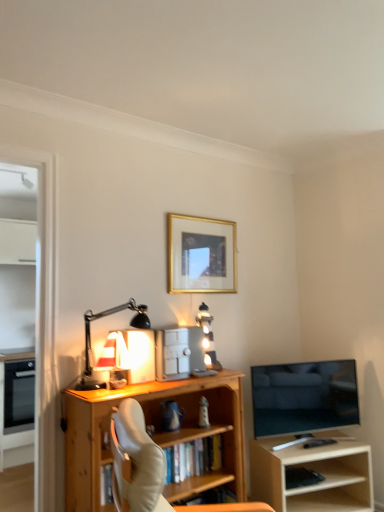
Question: Is black matte desk lamp at left not within light wood shelf at right?

Choices:
 (A) no
 (B) yes

Answer: (B)

Question: Would you say black matte desk lamp at left contains light wood shelf at right?

Choices:
 (A) no
 (B) yes

Answer: (A)

Question: Is black matte desk lamp at left positioned behind light wood shelf at right?

Choices:
 (A) yes
 (B) no

Answer: (B)

Question: Considering the relative sizes of black matte desk lamp at left and light wood shelf at right in the image provided, is black matte desk lamp at left bigger than light wood shelf at right?

Choices:
 (A) no
 (B) yes

Answer: (A)

Question: Is light wood shelf at right at the back of black matte desk lamp at left?

Choices:
 (A) yes
 (B) no

Answer: (B)

Question: From a real-world perspective, is matte black oven at left, which appears as the 2th appliance when viewed from the top, above or below black matte desk lamp at left?

Choices:
 (A) above
 (B) below

Answer: (B)

Question: Is matte black oven at left, which appears as the second appliance when viewed from the front, in front of or behind black matte desk lamp at left in the image?

Choices:
 (A) behind
 (B) front

Answer: (A)

Question: From the image's perspective, is matte black oven at left, the 2th appliance positioned from the right, above or below black matte desk lamp at left?

Choices:
 (A) above
 (B) below

Answer: (B)

Question: In terms of width, does matte black oven at left, the 2th appliance positioned from the right, look wider or thinner when compared to black matte desk lamp at left?

Choices:
 (A) thin
 (B) wide

Answer: (B)

Question: From the image's perspective, relative to gold-framed picture at upper center, is transparent glass door at left above or below?

Choices:
 (A) above
 (B) below

Answer: (B)

Question: From their relative heights in the image, would you say transparent glass door at left is taller or shorter than gold-framed picture at upper center?

Choices:
 (A) short
 (B) tall

Answer: (B)

Question: From a real-world perspective, is transparent glass door at left positioned above or below gold-framed picture at upper center?

Choices:
 (A) above
 (B) below

Answer: (B)

Question: Would you say transparent glass door at left is to the left or to the right of gold-framed picture at upper center in the picture?

Choices:
 (A) right
 (B) left

Answer: (B)

Question: Which is correct: light wood shelf at right is inside black matte keyboard at lower right, or outside of it?

Choices:
 (A) inside
 (B) outside

Answer: (B)

Question: In terms of height, does light wood shelf at right look taller or shorter compared to black matte keyboard at lower right?

Choices:
 (A) tall
 (B) short

Answer: (A)